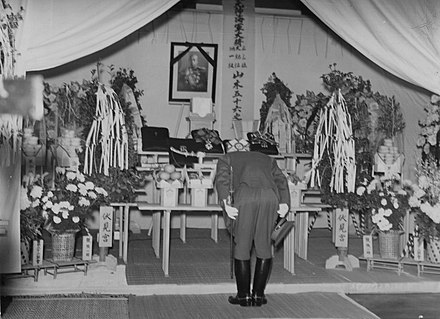
Find the location of a particular element. The width and height of the screenshot is (440, 319). black frame is located at coordinates (175, 89).